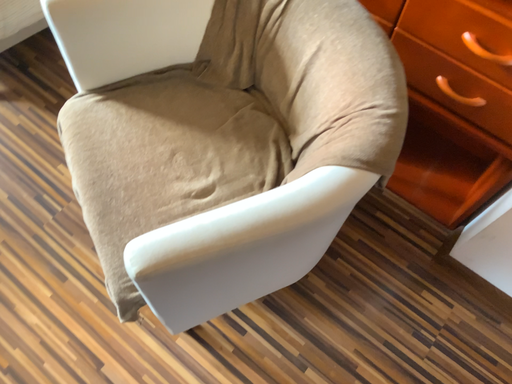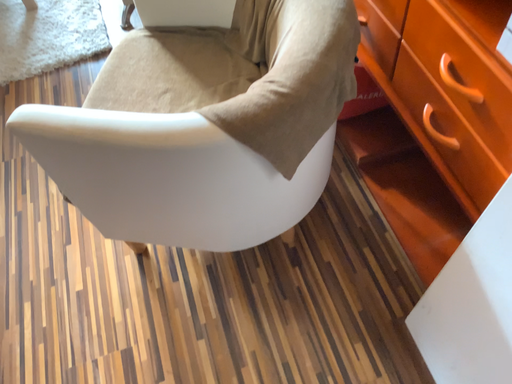
Question: Which way did the camera rotate in the video?

Choices:
 (A) rotated right
 (B) rotated left

Answer: (B)